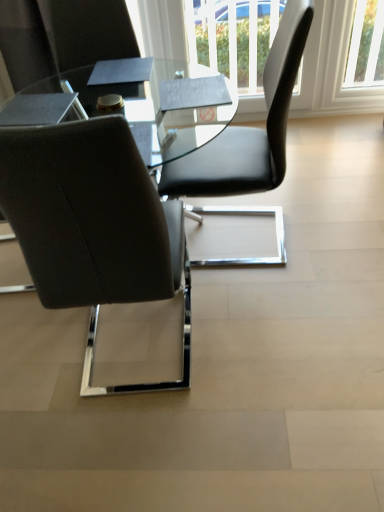
Question: Based on their positions, is transparent glass table at center located to the left or right of black leather chair at upper right, acting as the first chair starting from the right?

Choices:
 (A) left
 (B) right

Answer: (A)

Question: Do you think transparent glass table at center is within black leather chair at upper right, acting as the 2th chair starting from the left, or outside of it?

Choices:
 (A) outside
 (B) inside

Answer: (A)

Question: Which is nearer to the black leather chair at upper right, acting as the 2th chair starting from the left?

Choices:
 (A) matte black chair at left, the 2th chair from the right
 (B) white plastic window at upper right
 (C) transparent glass table at center

Answer: (C)

Question: Estimate the real-world distances between objects in this image. Which object is closer to the black leather chair at upper right, acting as the 2th chair starting from the left?

Choices:
 (A) transparent glass table at center
 (B) matte black chair at left, the 1th chair when ordered from left to right
 (C) white plastic window at upper right

Answer: (A)